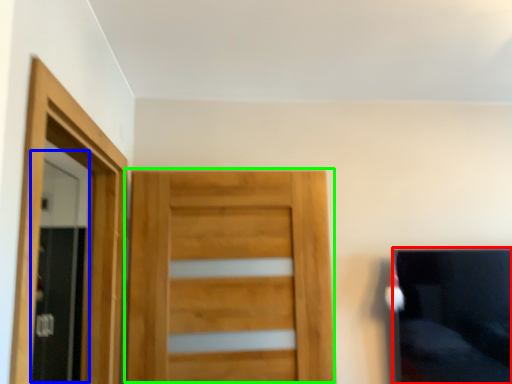
Question: Which object is the farthest from couch (highlighted by a red box)? Choose among these: screen door (highlighted by a blue box) or door (highlighted by a green box).

Choices:
 (A) screen door
 (B) door

Answer: (A)